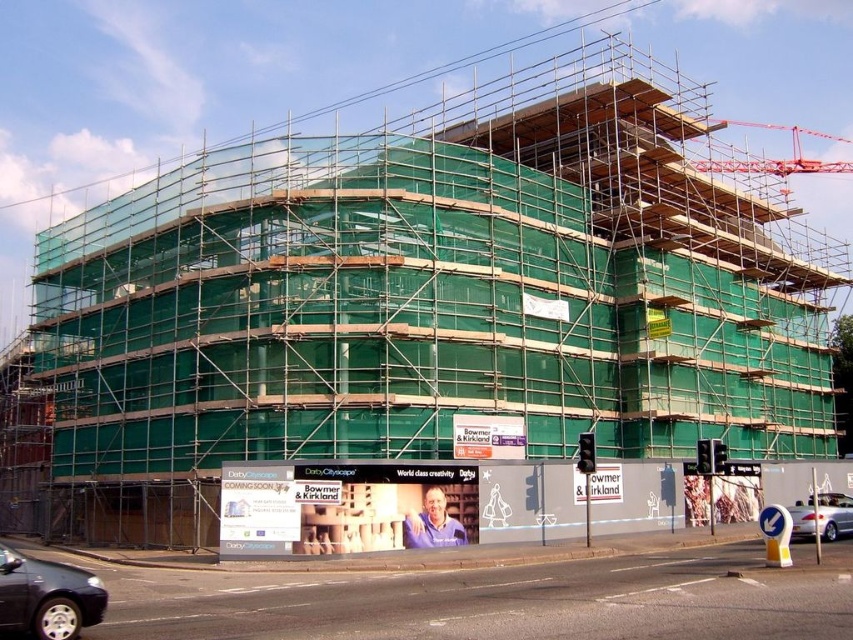
Who is taller, shiny black sedan at lower left or silver metallic car at lower right?

With more height is shiny black sedan at lower left.

Which is above, shiny black sedan at lower left or silver metallic car at lower right?

shiny black sedan at lower left

Locate an element on the screen. shiny black sedan at lower left is located at coordinates (47, 596).